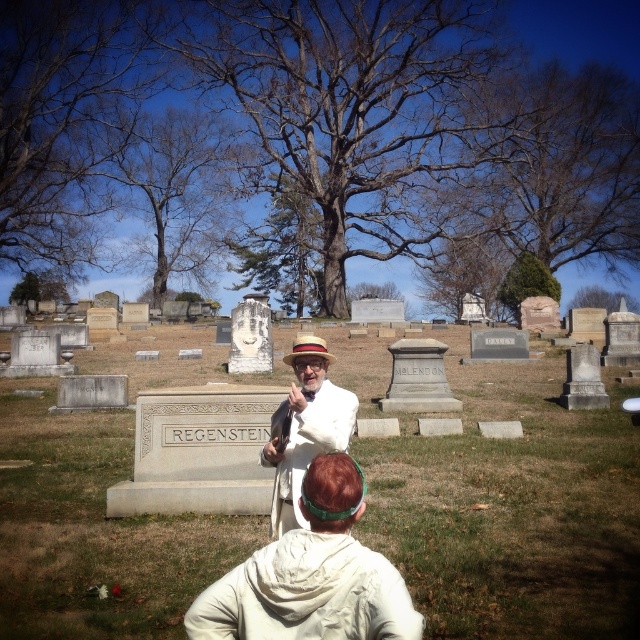
Is point (484, 573) behind point (312, 413)?

That is False.

Is gray stone gravestone at center taller than white cotton suit at center?

Yes.

Locate an element on the screen. This screenshot has height=640, width=640. gray stone gravestone at center is located at coordinates (513, 508).

Who is positioned more to the right, gray stone gravestone at center or brown straw cowboy hat at center?

Positioned to the right is gray stone gravestone at center.

Who is more distant from viewer, (186, 364) or (308, 344)?

Point (186, 364)

The height and width of the screenshot is (640, 640). I want to click on gray stone gravestone at center, so click(x=513, y=508).

Is white cotton hoodie at center taller than brown straw cowboy hat at center?

Incorrect, white cotton hoodie at center's height is not larger of brown straw cowboy hat at center's.

Is point (301, 593) positioned before point (321, 342)?

Yes, point (301, 593) is in front of point (321, 342).

At what (x,y) coordinates should I click in order to perform the action: click on white cotton hoodie at center. Please return your answer as a coordinate pair (x, y). This screenshot has height=640, width=640. Looking at the image, I should click on (310, 577).